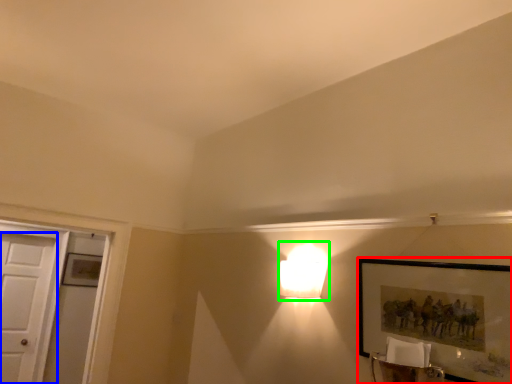
Question: Which object is positioned farthest from picture frame (highlighted by a red box)? Select from door (highlighted by a blue box) and lamp (highlighted by a green box).

Choices:
 (A) door
 (B) lamp

Answer: (A)